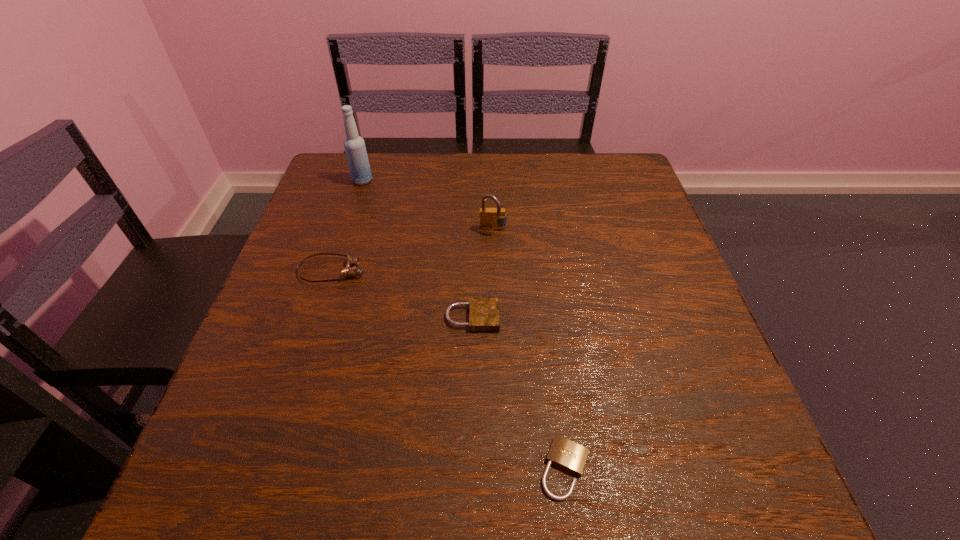
Find the location of a particular element. This screenshot has height=540, width=960. vacant area that lies between the rightmost padlock and the fourth shortest object is located at coordinates (529, 349).

In order to click on free space between the second nearest padlock and the nearest padlock in this screenshot , I will do `click(519, 393)`.

The height and width of the screenshot is (540, 960). In order to click on free space between the fourth shortest object and the fourth tallest object in this screenshot , I will do `click(483, 274)`.

Find the location of a particular element. empty space that is in between the goggles and the farthest padlock is located at coordinates click(413, 251).

Identify which object is the closest to the second farthest object. Please provide its 2D coordinates. Your answer should be formatted as a tuple, i.e. [(x, y)], where the tuple contains the x and y coordinates of a point satisfying the conditions above.

[(483, 311)]

Identify which object is the third closest to the fourth tallest object. Please provide its 2D coordinates. Your answer should be formatted as a tuple, i.e. [(x, y)], where the tuple contains the x and y coordinates of a point satisfying the conditions above.

[(564, 453)]

This screenshot has width=960, height=540. Identify the location of padlock that can be found as the closest to the second farthest object. (483, 311).

Locate an element on the screen. The height and width of the screenshot is (540, 960). padlock that is the second closest to the goggles is located at coordinates (490, 218).

Identify the location of vacant position in the image that satisfies the following two spatial constraints: 1. on the back side of the rightmost padlock; 2. on the front lenses and sides of the third nearest object. The width and height of the screenshot is (960, 540). (540, 271).

The width and height of the screenshot is (960, 540). I want to click on blank space that satisfies the following two spatial constraints: 1. on the side with the combination dials of the second tallest object; 2. on the front lenses and sides of the third shortest object, so click(494, 271).